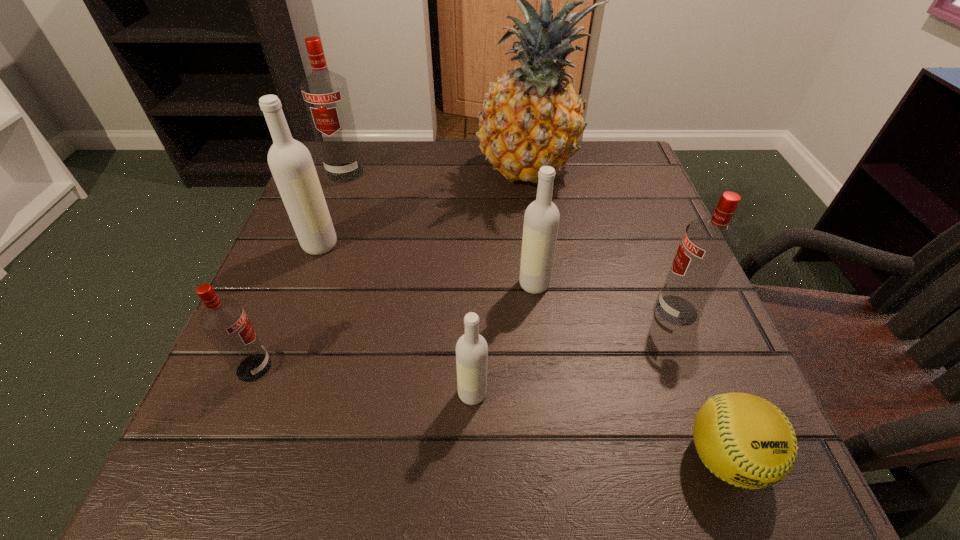
Find the location of a particular element. The width and height of the screenshot is (960, 540). pineapple is located at coordinates (532, 117).

This screenshot has height=540, width=960. In order to click on yellow pineapple in this screenshot , I will do `click(532, 117)`.

Where is `the farthest white vodka`? the farthest white vodka is located at coordinates (291, 164).

Image resolution: width=960 pixels, height=540 pixels. I want to click on the biggest white vodka, so click(x=291, y=164).

What are the coordinates of `the farthest vodka` in the screenshot? It's located at (325, 93).

I want to click on the biggest red vodka, so click(325, 93).

Identify the location of the rightmost white vodka. (541, 220).

Locate an element on the screen. the second vodka from right to left is located at coordinates (541, 220).

I want to click on the second nearest red vodka, so click(x=708, y=245).

This screenshot has width=960, height=540. Identify the location of the rightmost red vodka. (708, 245).